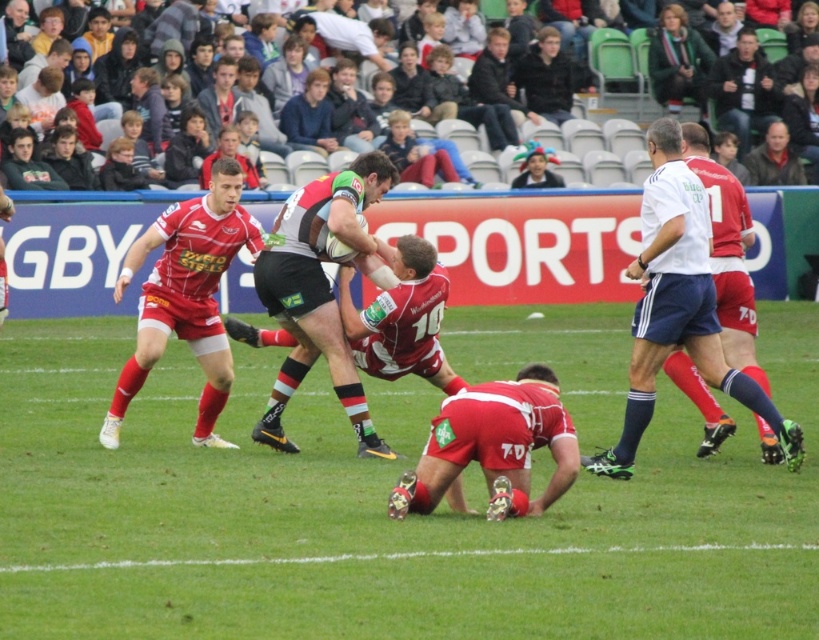
You are a photographer standing at the edge of the rugby field. You want to take a photo focusing on two specific points marked in the image. The first point is at coordinates point (664, 326), and the second is at point (295, 445). Which of these points will appear larger in your photo?

Point (664, 326) is closer to the camera than point (295, 445), so it will appear larger in the photo.